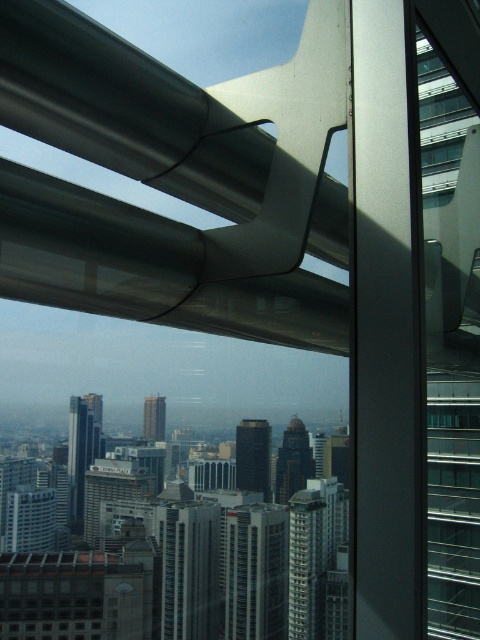
You are standing at a high vantage point inside a modern building overlooking a city. You notice two points in the scene labeled as point 1 at coordinates (243, 540) and point 2 at coordinates (186, 547). Which point is physically closer to your current position?

Point 1 at coordinates (243, 540) is closer to the viewer than point 2 at coordinates (186, 547).

You are standing at the vantage point looking out over the city. You notice a point marked at coordinates (x=256, y=572). What does this point correspond to in the scene?

The point (x=256, y=572) corresponds to the glassy reflective building at center.

You are an urban planner reviewing a city layout. You need to determine the relative positioning of two key buildings in the scene. Which building is positioned to the left when viewing the gray concrete building at center and the black glass tower at center?

The gray concrete building at center is positioned to the left of the black glass tower at center.